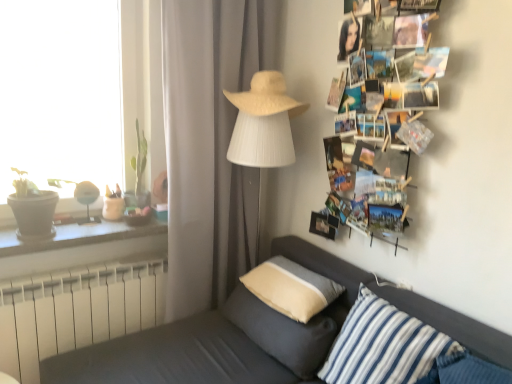
Question: Is white fabric lampshade at center thinner than white woven hat at upper center?

Choices:
 (A) no
 (B) yes

Answer: (B)

Question: Can white woven hat at upper center be found inside white fabric lampshade at center?

Choices:
 (A) no
 (B) yes

Answer: (A)

Question: Is white fabric lampshade at center positioned far away from white woven hat at upper center?

Choices:
 (A) yes
 (B) no

Answer: (B)

Question: Does white fabric lampshade at center have a greater width compared to white woven hat at upper center?

Choices:
 (A) no
 (B) yes

Answer: (A)

Question: Considering the relative sizes of white fabric lampshade at center and white woven hat at upper center in the image provided, is white fabric lampshade at center taller than white woven hat at upper center?

Choices:
 (A) no
 (B) yes

Answer: (B)

Question: Choose the correct answer: Is dark gray fabric couch at lower left inside white plastic radiator at lower left or outside it?

Choices:
 (A) outside
 (B) inside

Answer: (A)

Question: From a real-world perspective, relative to white plastic radiator at lower left, is dark gray fabric couch at lower left vertically above or below?

Choices:
 (A) below
 (B) above

Answer: (A)

Question: In terms of height, does dark gray fabric couch at lower left look taller or shorter compared to white plastic radiator at lower left?

Choices:
 (A) short
 (B) tall

Answer: (B)

Question: In the image, is dark gray fabric couch at lower left on the left side or the right side of white plastic radiator at lower left?

Choices:
 (A) right
 (B) left

Answer: (A)

Question: From a real-world perspective, is dark gray fabric couch at lower left physically located above or below white woven hat at upper center?

Choices:
 (A) below
 (B) above

Answer: (A)

Question: Is point (192, 369) closer or farther from the camera than point (258, 82)?

Choices:
 (A) closer
 (B) farther

Answer: (A)

Question: Is dark gray fabric couch at lower left inside the boundaries of white woven hat at upper center, or outside?

Choices:
 (A) inside
 (B) outside

Answer: (B)

Question: From the image's perspective, is dark gray fabric couch at lower left positioned above or below white woven hat at upper center?

Choices:
 (A) above
 (B) below

Answer: (B)

Question: Looking at the image, does dark gray fabric couch at lower left seem bigger or smaller compared to printed paper collage at upper right?

Choices:
 (A) big
 (B) small

Answer: (A)

Question: Is point (397, 294) closer or farther from the camera than point (332, 178)?

Choices:
 (A) closer
 (B) farther

Answer: (A)